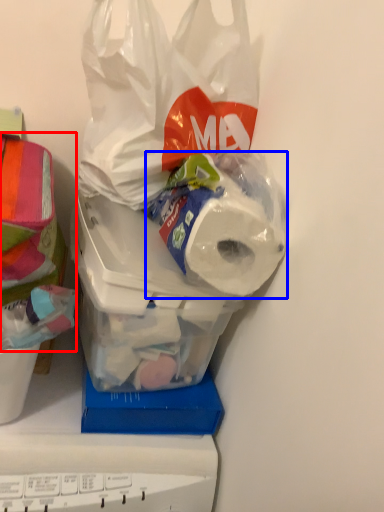
Question: Which object appears farthest to the camera in this image, wrapping paper (highlighted by a red box) or toilet paper (highlighted by a blue box)?

Choices:
 (A) wrapping paper
 (B) toilet paper

Answer: (B)